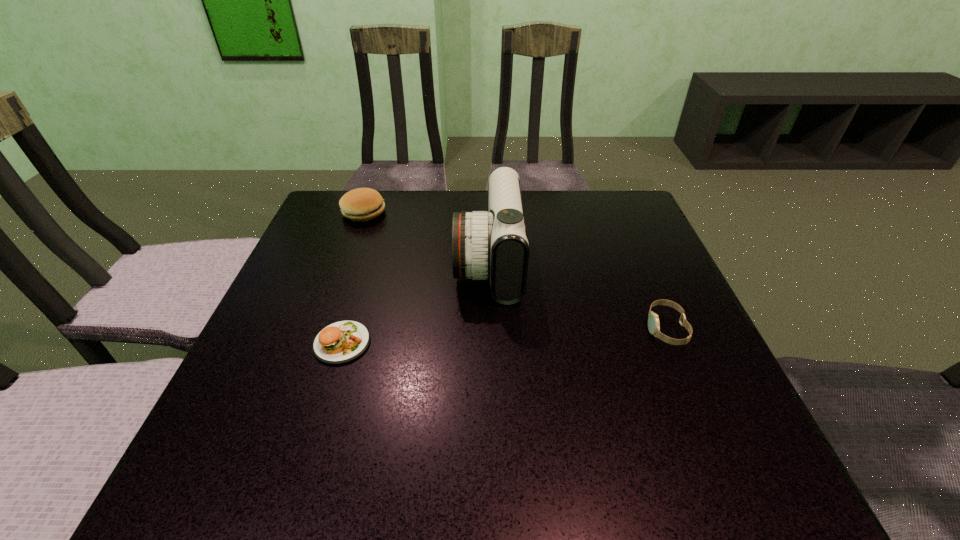
I want to click on camcorder, so click(x=493, y=244).

Locate an element on the screen. The width and height of the screenshot is (960, 540). the tallest object is located at coordinates (493, 244).

Identify the location of the farthest object. (362, 204).

Locate an element on the screen. This screenshot has width=960, height=540. the farther patty is located at coordinates (362, 204).

The width and height of the screenshot is (960, 540). Identify the location of the rightmost object. (653, 321).

This screenshot has height=540, width=960. I want to click on the nearer patty, so click(x=340, y=342).

Image resolution: width=960 pixels, height=540 pixels. I want to click on free space located 0.240m on the surface of the camcorder, so click(354, 262).

This screenshot has width=960, height=540. I want to click on free location located 0.120m on the surface of the camcorder, so click(405, 262).

This screenshot has height=540, width=960. I want to click on free space located on the surface of the camcorder, so click(418, 262).

The image size is (960, 540). I want to click on free region located 0.310m on the right of the farther patty, so click(500, 212).